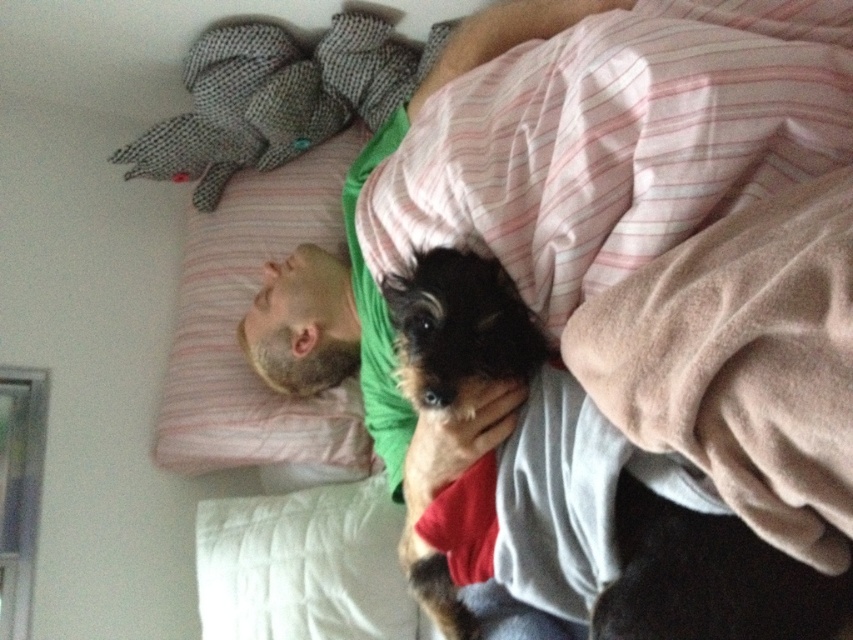
Measure the distance between point (813, 573) and camera.

They are 74.19 centimeters apart.

Between shaggy brown dog at center and pink striped pillow at upper left, which one is positioned higher?

pink striped pillow at upper left

The width and height of the screenshot is (853, 640). What do you see at coordinates (708, 579) in the screenshot?
I see `shaggy brown dog at center` at bounding box center [708, 579].

Find the location of `shaggy brown dog at center`. shaggy brown dog at center is located at coordinates point(708,579).

Who is lower down, beige soft blanket at upper right or shaggy brown dog at center?

shaggy brown dog at center is below.

What do you see at coordinates (741, 362) in the screenshot?
I see `beige soft blanket at upper right` at bounding box center [741, 362].

Find the location of a particular element. beige soft blanket at upper right is located at coordinates (741, 362).

Identify the location of beige soft blanket at upper right. click(741, 362).

Does beige soft blanket at upper right appear over pink striped pillow at upper left?

Actually, beige soft blanket at upper right is below pink striped pillow at upper left.

Which of these two, beige soft blanket at upper right or pink striped pillow at upper left, stands taller?

pink striped pillow at upper left is taller.

Who is more forward, (573, 333) or (248, 417)?

Point (573, 333) is more forward.

The width and height of the screenshot is (853, 640). Find the location of `beige soft blanket at upper right`. beige soft blanket at upper right is located at coordinates (741, 362).